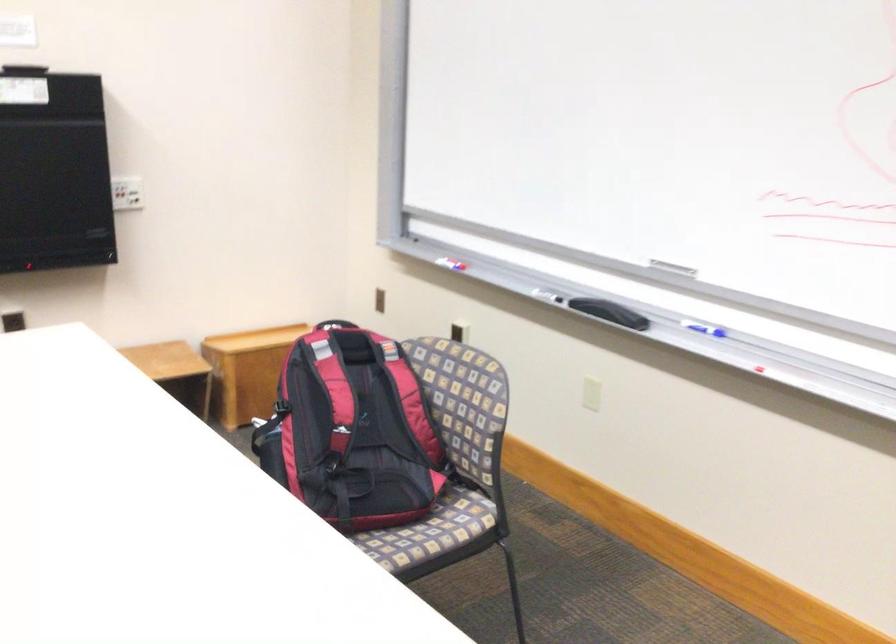
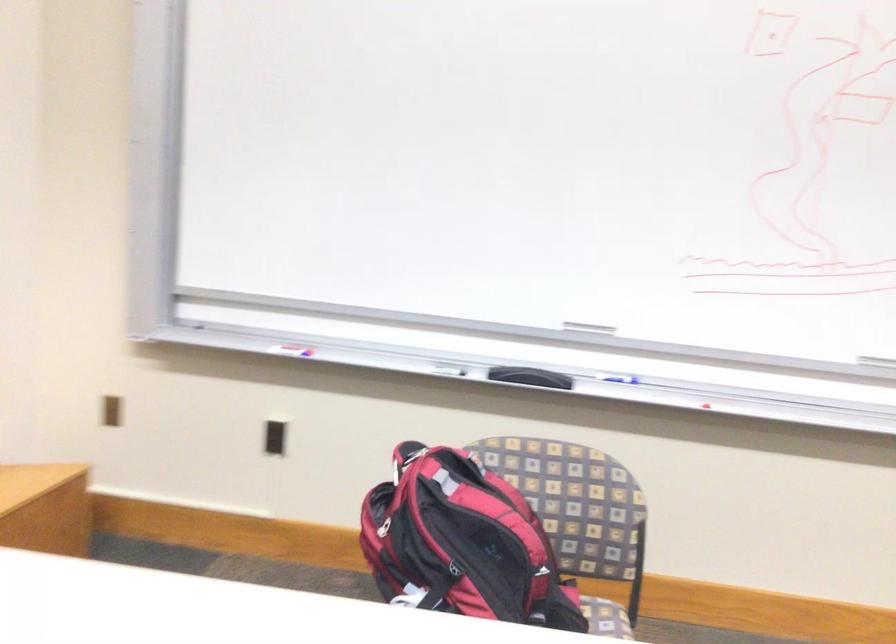
Where in the second image is the point corresponding to point (483, 520) from the first image?

(606, 618)